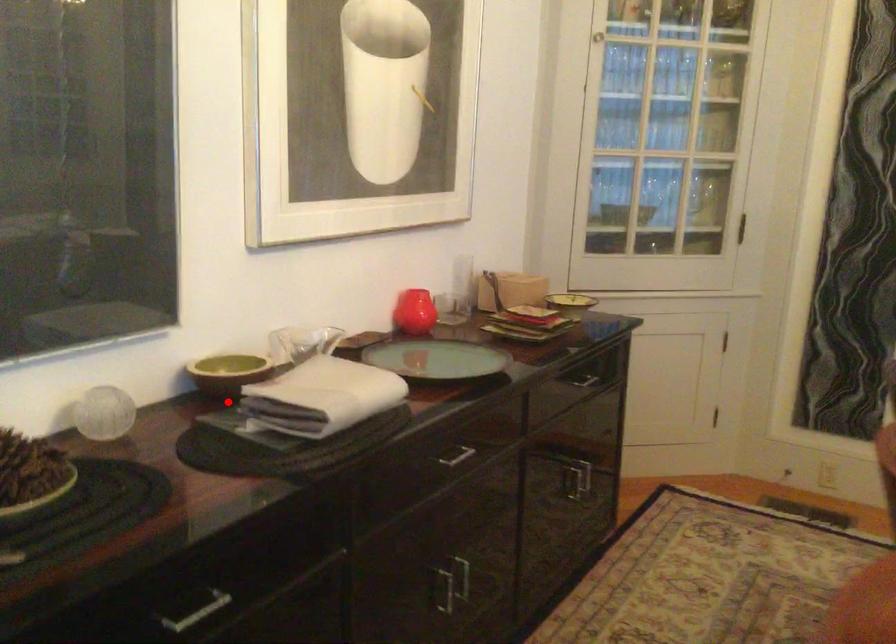
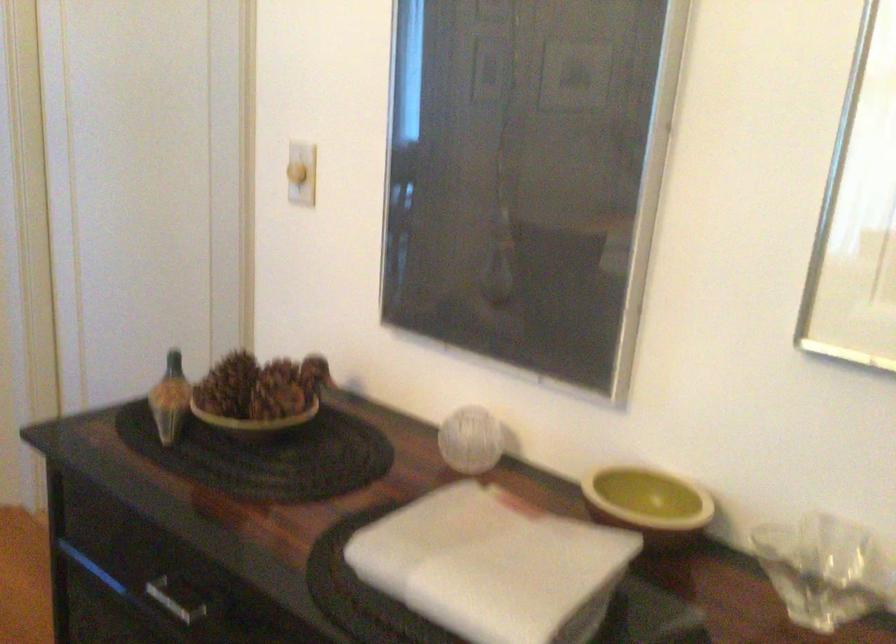
Locate, in the second image, the point that corresponds to the highlighted location in the first image.

(648, 503)